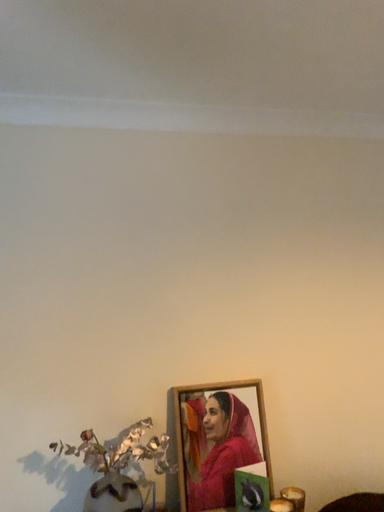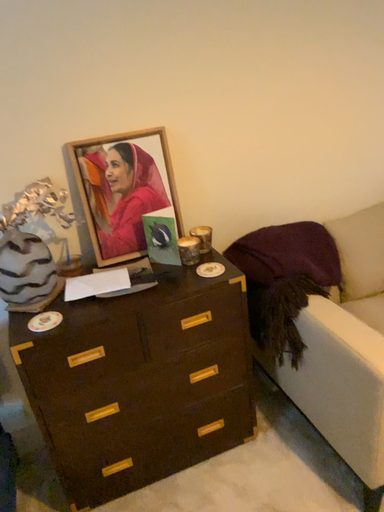
Question: How did the camera likely rotate when shooting the video?

Choices:
 (A) rotated right
 (B) rotated left

Answer: (A)